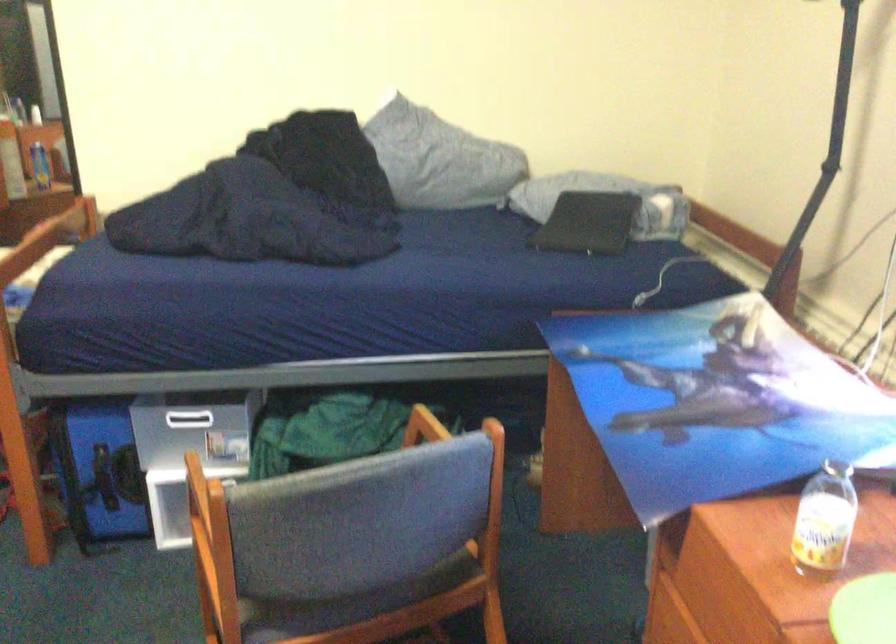
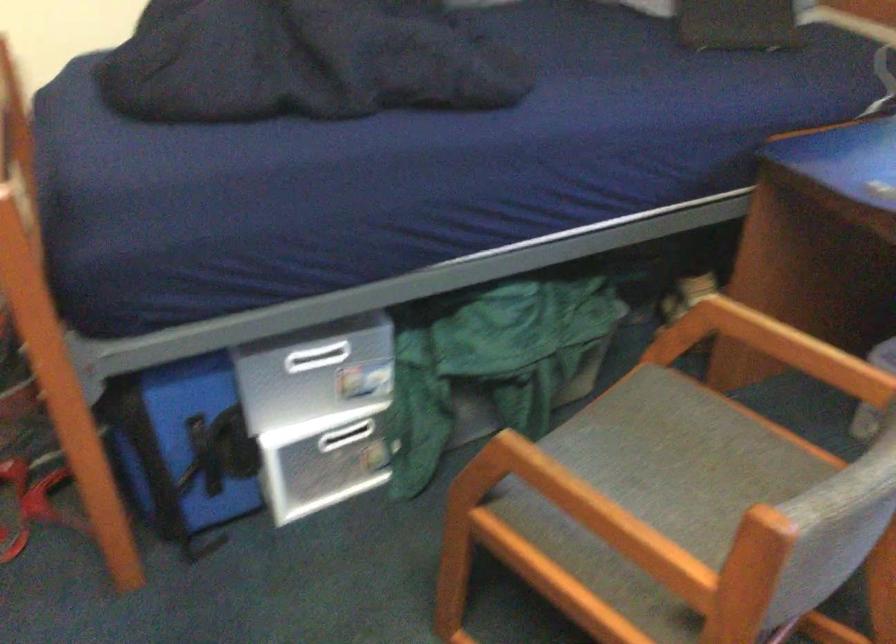
Find the pixel in the second image that matches the point at 99,453 in the first image.

(200, 428)